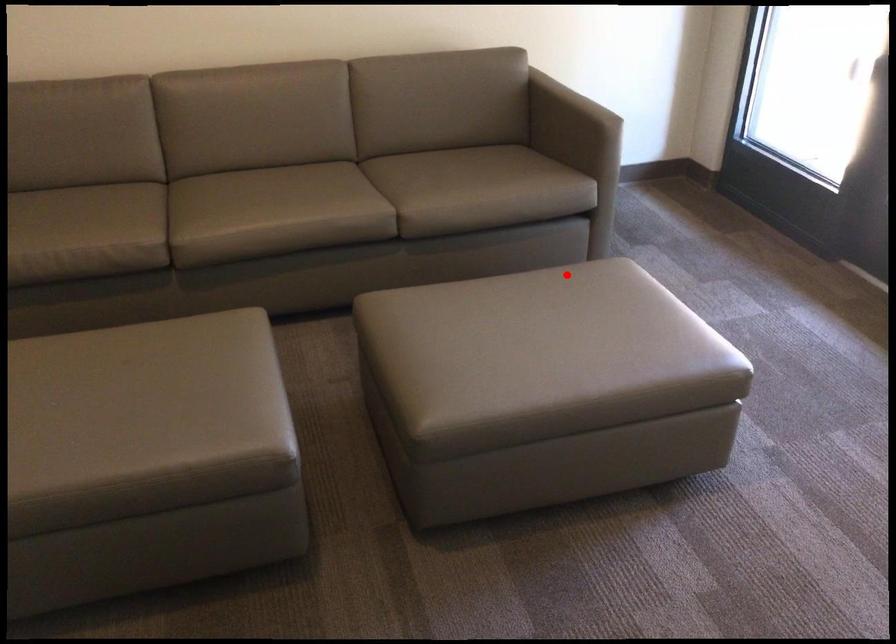
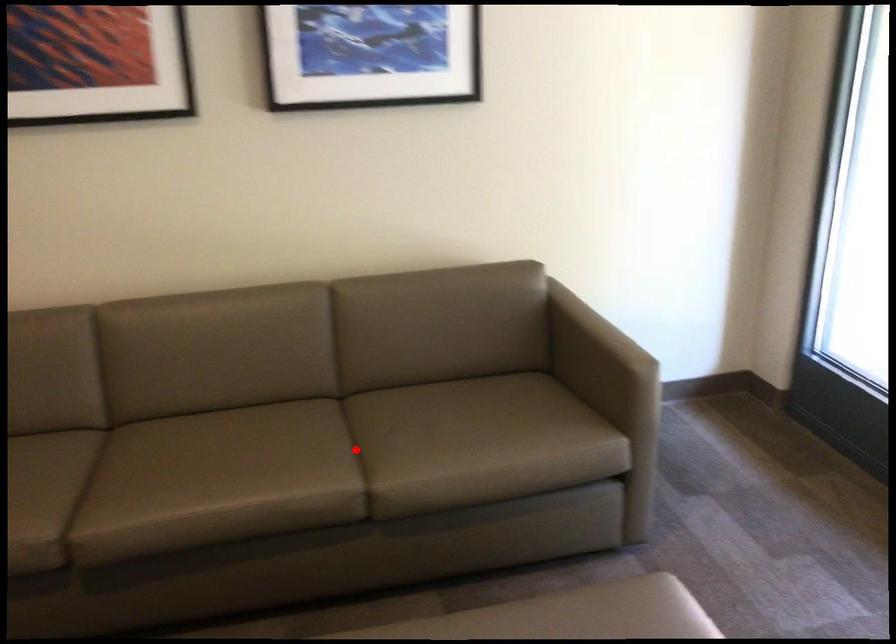
I am providing you with two images of the same scene from different viewpoints. A red point is marked on the first image and another point is marked on the second image. Does the point marked in image1 correspond to the same location as the one in image2?

No